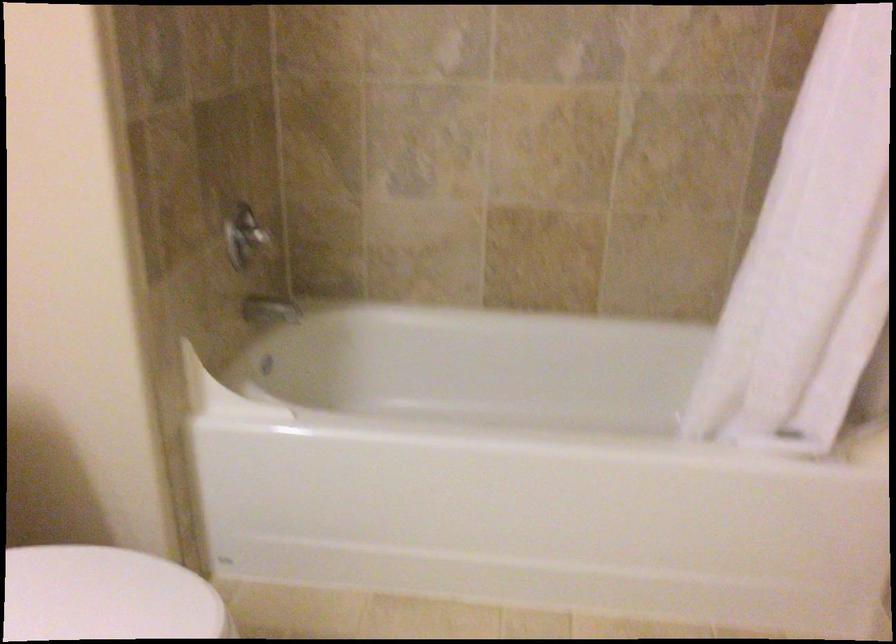
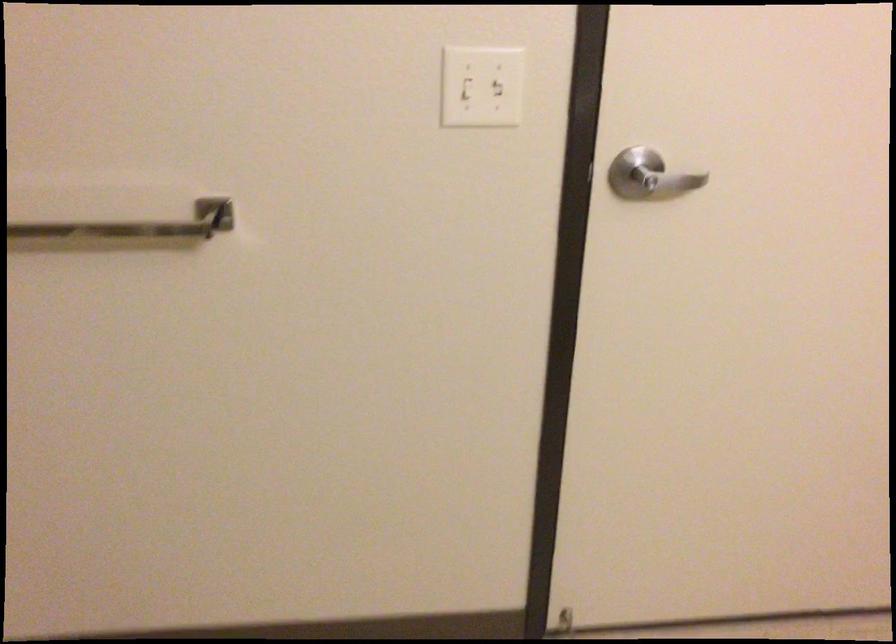
The images are taken continuously from a first-person perspective. In which direction is your viewpoint rotating?

The rotation direction of the camera is right-down.